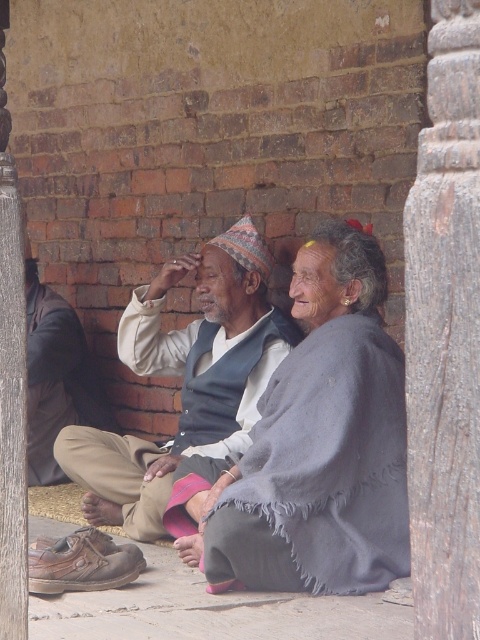
Question: Does gray woolen shawl at center appear on the right side of light brown fabric hat at center?

Choices:
 (A) yes
 (B) no

Answer: (A)

Question: Which object is positioned closest to the light brown fabric hat at center?

Choices:
 (A) smooth skin forehead at center
 (B) gray woolen shawl at center
 (C) smooth gray stone pillar at left
 (D) wooden textured pillar at right

Answer: (B)

Question: Which point appears farthest from the camera in this image?

Choices:
 (A) (16, 573)
 (B) (98, 467)
 (C) (26, 365)

Answer: (B)

Question: In this image, where is light brown fabric hat at center located relative to smooth gray stone pillar at left?

Choices:
 (A) below
 (B) above

Answer: (A)

Question: Does light brown fabric hat at center have a greater width compared to smooth skin forehead at center?

Choices:
 (A) yes
 (B) no

Answer: (A)

Question: Which point is farther to the camera?

Choices:
 (A) smooth skin forehead at center
 (B) light brown fabric hat at center
 (C) gray woolen robe at left

Answer: (C)